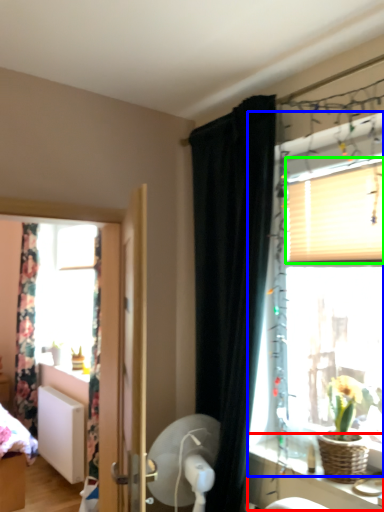
Question: Which is nearer to the vanity (highlighted by a red box)? window (highlighted by a blue box) or blind (highlighted by a green box).

Choices:
 (A) window
 (B) blind

Answer: (A)